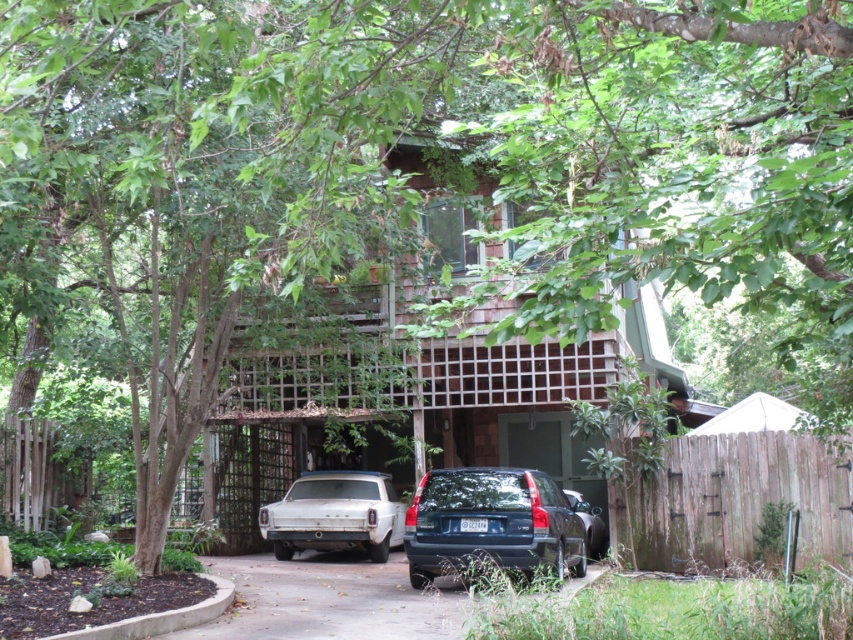
Between point (442, 616) and point (346, 529), which one is positioned behind?

The point (346, 529) is more distant.

Is concrete driveway at center smaller than white matte sedan at lower left?

No.

Identify the location of concrete driveway at center. (329, 600).

Which is above, matte dark blue suv at center or white matte sedan at lower left?

Positioned higher is matte dark blue suv at center.

Who is more distant from viewer, (425, 506) or (337, 474)?

The point (337, 474) is behind.

At what (x,y) coordinates should I click in order to perform the action: click on matte dark blue suv at center. Please return your answer as a coordinate pair (x, y). The height and width of the screenshot is (640, 853). Looking at the image, I should click on (491, 524).

Can you confirm if concrete driveway at center is positioned below matte dark blue suv at center?

Yes.

Is point (439, 595) positioned before point (486, 547)?

No, (439, 595) is further to viewer.

Where is `concrete driveway at center`? Image resolution: width=853 pixels, height=640 pixels. concrete driveway at center is located at coordinates (329, 600).